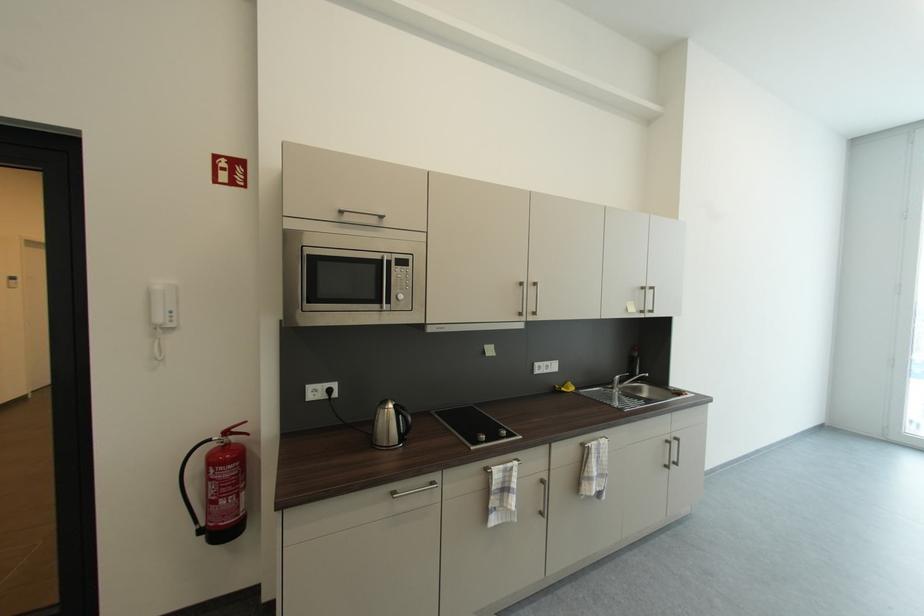
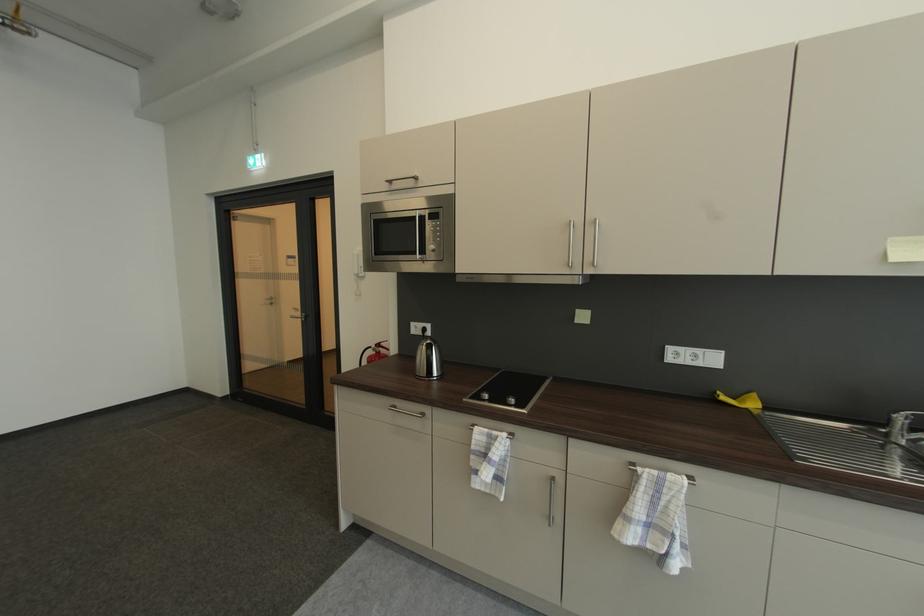
In the second image, find the point that corresponds to pixel 617 387 in the first image.

(892, 432)